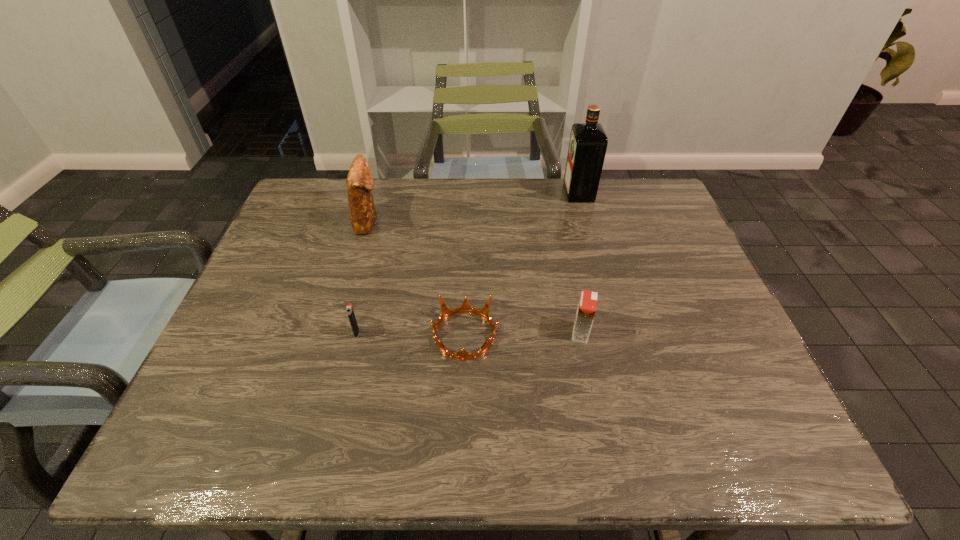
I want to click on vacant space at the near edge of the desktop, so click(612, 428).

The image size is (960, 540). Find the location of `free space at the left edge of the desktop`. free space at the left edge of the desktop is located at coordinates coord(326,247).

At what (x,y) coordinates should I click in order to perform the action: click on free space at the right edge of the desktop. Please return your answer as a coordinate pair (x, y). The image size is (960, 540). Looking at the image, I should click on (668, 299).

Find the location of a particular element. The image size is (960, 540). vacant space at the far left corner of the desktop is located at coordinates (340, 213).

I want to click on vacant space at the far right corner of the desktop, so click(635, 204).

In order to click on vacant space in between the fourth shortest object and the fourth object from left to right in this screenshot , I will do `click(474, 276)`.

Locate an element on the screen. Image resolution: width=960 pixels, height=540 pixels. empty space that is in between the crown and the igniter is located at coordinates (411, 334).

The image size is (960, 540). In order to click on empty location between the clutch bag and the second shortest object in this screenshot , I will do `click(362, 276)`.

Locate an element on the screen. free space that is in between the tallest object and the igniter is located at coordinates (468, 262).

The width and height of the screenshot is (960, 540). Find the location of `free space between the shortest object and the igniter`. free space between the shortest object and the igniter is located at coordinates (411, 334).